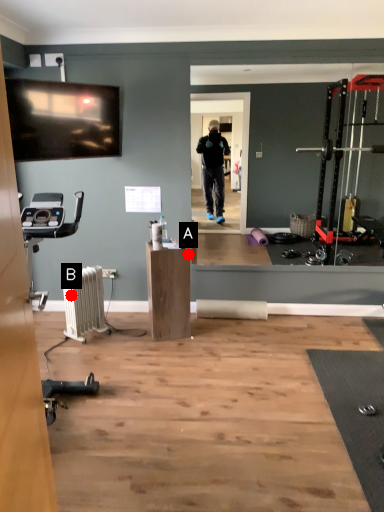
Question: Two points are circled on the image, labeled by A and B beside each circle. Which point appears closest to the camera in this image?

Choices:
 (A) A is closer
 (B) B is closer

Answer: (B)